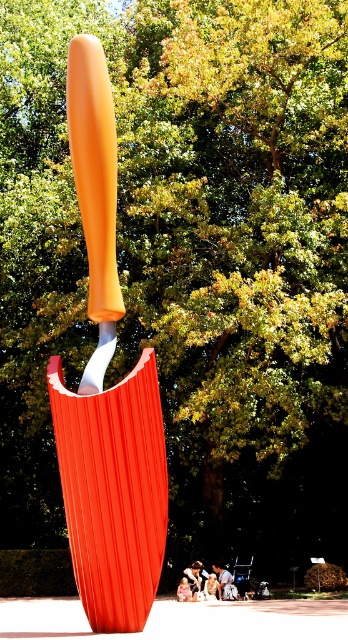
Can you confirm if smooth beige shirt at center is positioned below white cotton shirt at lower center?

Indeed, smooth beige shirt at center is positioned under white cotton shirt at lower center.

Which is more to the left, smooth beige shirt at center or white cotton shirt at lower center?

From the viewer's perspective, white cotton shirt at lower center appears more on the left side.

What do you see at coordinates (211, 588) in the screenshot? I see `smooth beige shirt at center` at bounding box center [211, 588].

You are a GUI agent. You are given a task and a screenshot of the screen. Output one action in this format:
    pyautogui.click(x=<x>, y=<y>)
    Task: Click on the smooth beige shirt at center
    The image size is (348, 640).
    Given the screenshot: What is the action you would take?
    pyautogui.click(x=211, y=588)

Can you confirm if orange matte knife at center is positioned above smooth white shirt at center?

Yes, orange matte knife at center is above smooth white shirt at center.

You are a GUI agent. You are given a task and a screenshot of the screen. Output one action in this format:
    pyautogui.click(x=<x>, y=<y>)
    Task: Click on the orange matte knife at center
    Image resolution: width=348 pixels, height=640 pixels.
    Given the screenshot: What is the action you would take?
    pyautogui.click(x=106, y=392)

The image size is (348, 640). What are the coordinates of `orange matte knife at center` in the screenshot? It's located at (106, 392).

Is orange matte shovel at center smaller than white fabric person at center?

Correct, orange matte shovel at center occupies less space than white fabric person at center.

Can you confirm if orange matte shovel at center is positioned to the right of white fabric person at center?

In fact, orange matte shovel at center is to the left of white fabric person at center.

Which is behind, point (83, 388) or point (192, 596)?

The point (192, 596) is more distant.

The width and height of the screenshot is (348, 640). I want to click on orange matte shovel at center, so click(95, 193).